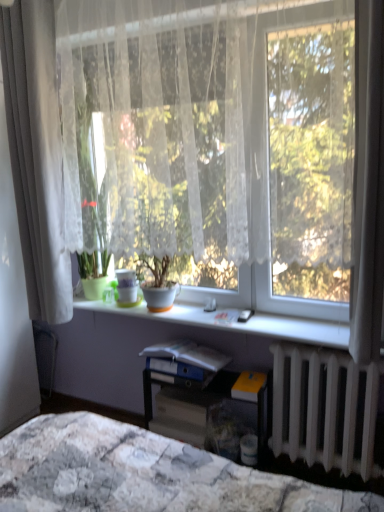
Question: Which direction should I rotate to look at blue matte folder at center, which appears as the 3th paperback book when ordered from the bottom, — up or down?

Choices:
 (A) down
 (B) up

Answer: (A)

Question: From the image's perspective, is white glossy window sill at center located above matte gray paperback book at center, the first paperback book when ordered from bottom to top?

Choices:
 (A) no
 (B) yes

Answer: (B)

Question: Is white glossy window sill at center wider than matte gray paperback book at center, the 3th paperback book in the top-to-bottom sequence?

Choices:
 (A) no
 (B) yes

Answer: (B)

Question: From a real-world perspective, is white glossy window sill at center below matte gray paperback book at center, the 3th paperback book in the top-to-bottom sequence?

Choices:
 (A) yes
 (B) no

Answer: (B)

Question: Is white glossy window sill at center far away from matte gray paperback book at center, the 3th paperback book in the top-to-bottom sequence?

Choices:
 (A) yes
 (B) no

Answer: (B)

Question: Is white glossy window sill at center placed right next to matte gray paperback book at center, the first paperback book when ordered from bottom to top?

Choices:
 (A) no
 (B) yes

Answer: (A)

Question: Considering the relative sizes of white glossy window sill at center and matte gray paperback book at center, the 3th paperback book in the top-to-bottom sequence, in the image provided, is white glossy window sill at center thinner than matte gray paperback book at center, the 3th paperback book in the top-to-bottom sequence,?

Choices:
 (A) no
 (B) yes

Answer: (A)

Question: Is green matte pot at center, the 1th houseplant in the left-to-right sequence, positioned with its back to white lace curtain at center?

Choices:
 (A) yes
 (B) no

Answer: (B)

Question: From the image's perspective, is green matte pot at center, the 1th houseplant in the left-to-right sequence, on white lace curtain at center?

Choices:
 (A) no
 (B) yes

Answer: (A)

Question: From a real-world perspective, is green matte pot at center, placed as the second houseplant when sorted from right to left, on white lace curtain at center?

Choices:
 (A) yes
 (B) no

Answer: (B)

Question: Can you see green matte pot at center, the 1th houseplant in the left-to-right sequence, touching white lace curtain at center?

Choices:
 (A) yes
 (B) no

Answer: (B)

Question: From a real-world perspective, is green matte pot at center, placed as the second houseplant when sorted from right to left, positioned under white lace curtain at center based on gravity?

Choices:
 (A) no
 (B) yes

Answer: (B)

Question: Can you confirm if green matte pot at center, placed as the second houseplant when sorted from right to left, is bigger than white lace curtain at center?

Choices:
 (A) no
 (B) yes

Answer: (A)

Question: From the image's perspective, is matte white pot at center, placed as the first houseplant when sorted from right to left, beneath matte gray paperback book at center, the 3th paperback book in the top-to-bottom sequence?

Choices:
 (A) no
 (B) yes

Answer: (A)